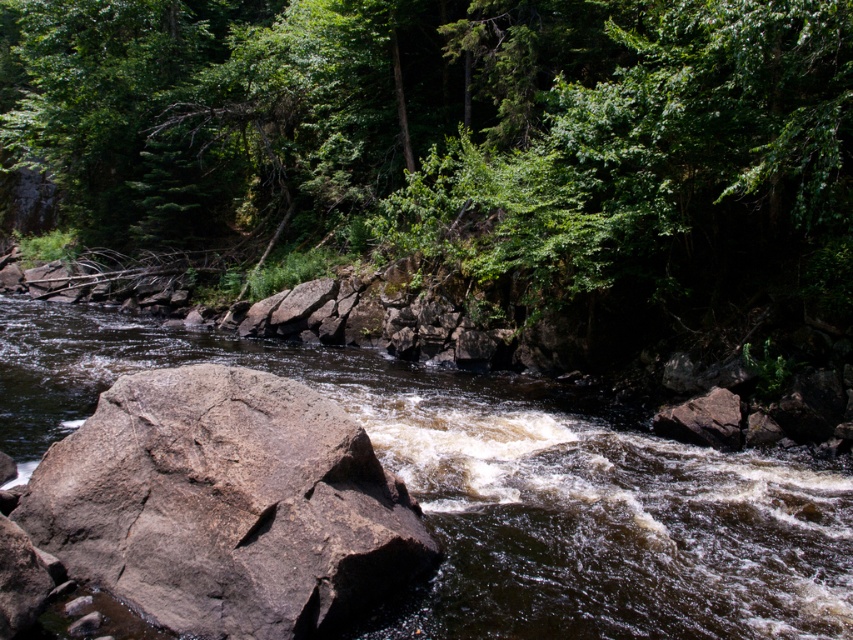
Looking at this image, you are standing at the bottom of the image and looking upward. Which direction should you look to see the green leafy tree at upper center?

The green leafy tree at upper center is located at point (457,134), so you should look upward and slightly to the left to see it.

Looking at this image, you are standing on the bank of the river and see the brown rock at center and the gray rough rock at center. Which rock is taller?

The brown rock at center is taller than the gray rough rock at center.